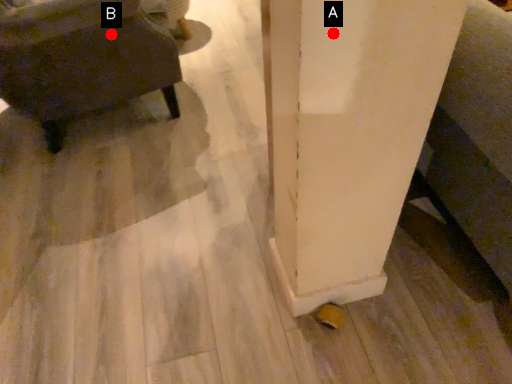
Question: Two points are circled on the image, labeled by A and B beside each circle. Which point is closer to the camera?

Choices:
 (A) A is closer
 (B) B is closer

Answer: (A)